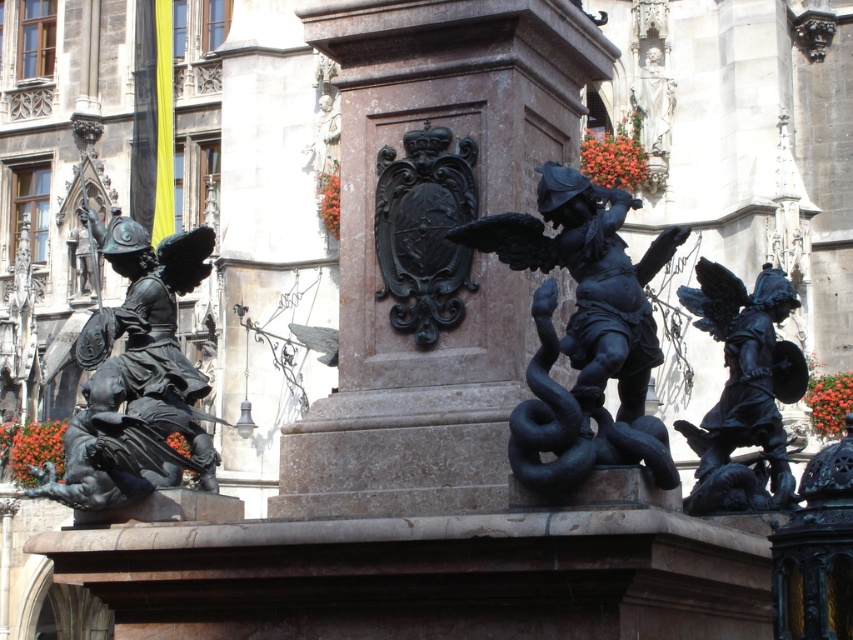
Is bronze warrior at left positioned at the back of polished bronze angel at right?

No, bronze warrior at left is closer to the viewer.

Who is more forward, (125, 236) or (750, 312)?

Point (125, 236) is in front.

Is point (142, 236) behind point (762, 442)?

No, (142, 236) is in front of (762, 442).

At what (x,y) coordinates should I click in order to perform the action: click on bronze warrior at left. Please return your answer as a coordinate pair (x, y). Image resolution: width=853 pixels, height=640 pixels. Looking at the image, I should click on (136, 380).

Does black polished statue at center come in front of polished bronze figure at center?

No, it is not.

Identify the location of black polished statue at center. (582, 333).

Image resolution: width=853 pixels, height=640 pixels. In order to click on black polished statue at center in this screenshot , I will do `click(582, 333)`.

Does black polished statue at center have a lesser width compared to polished bronze angel at right?

Indeed, black polished statue at center has a lesser width compared to polished bronze angel at right.

Does black polished statue at center appear on the right side of polished bronze angel at right?

Incorrect, black polished statue at center is not on the right side of polished bronze angel at right.

Does point (624, 285) come closer to viewer compared to point (688, 435)?

Yes, it is.

I want to click on black polished statue at center, so click(x=582, y=333).